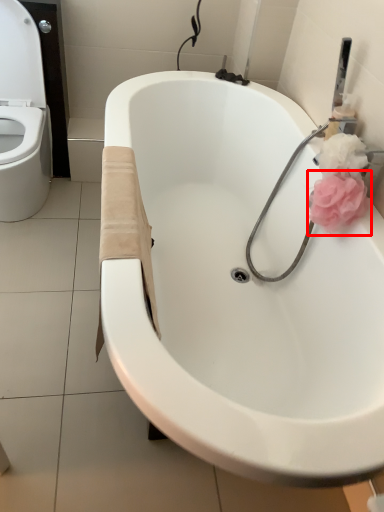
Question: From the image's perspective, what is the correct spatial positioning of rose (annotated by the red box) in reference to bathtub?

Choices:
 (A) above
 (B) below

Answer: (A)